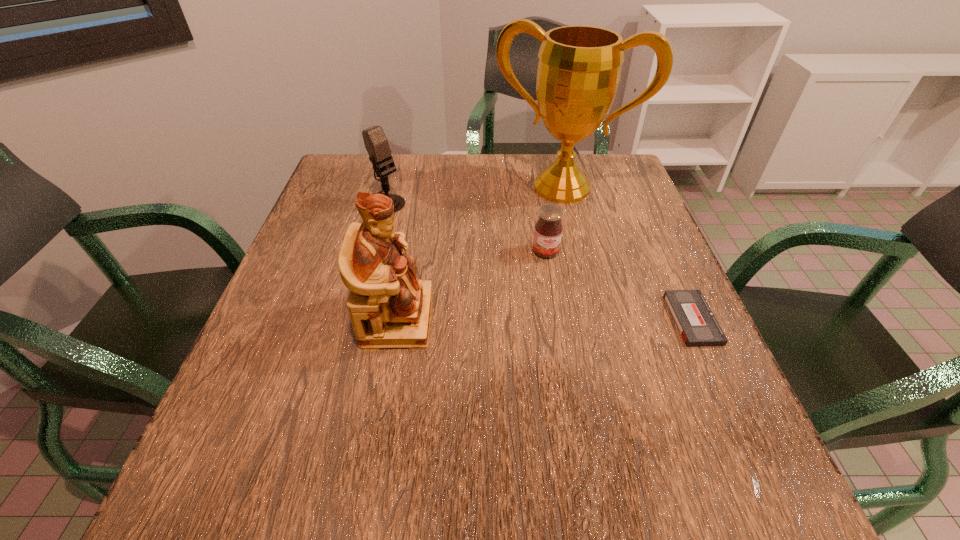
Image resolution: width=960 pixels, height=540 pixels. I want to click on free space located 0.150m on the label side of the third nearest object, so click(x=560, y=307).

You are a GUI agent. You are given a task and a screenshot of the screen. Output one action in this format:
    pyautogui.click(x=<x>, y=<y>)
    Task: Click on the free point located on the front-facing side of the tallest object
    
    Given the screenshot: What is the action you would take?
    pyautogui.click(x=501, y=298)

Where is `vacant space located on the front-facing side of the tallest object`? This screenshot has height=540, width=960. vacant space located on the front-facing side of the tallest object is located at coordinates (533, 227).

Find the location of a particular element. This screenshot has width=960, height=540. vacant point located 0.190m on the front-facing side of the tallest object is located at coordinates (523, 248).

Locate an element on the screen. free space located on the front-facing side of the third shortest object is located at coordinates (502, 272).

Where is `vacant point located 0.170m on the front-facing side of the third shortest object`? vacant point located 0.170m on the front-facing side of the third shortest object is located at coordinates (442, 237).

The height and width of the screenshot is (540, 960). Identify the location of vacant space positioned 0.370m on the front-facing side of the third shortest object. (502, 272).

At what (x,y) coordinates should I click in order to perform the action: click on award that is at the far edge. Please return your answer as a coordinate pair (x, y). Looking at the image, I should click on (579, 68).

I want to click on microphone present at the far edge, so click(376, 143).

This screenshot has width=960, height=540. Find the location of `object that is at the left edge`. object that is at the left edge is located at coordinates (376, 143).